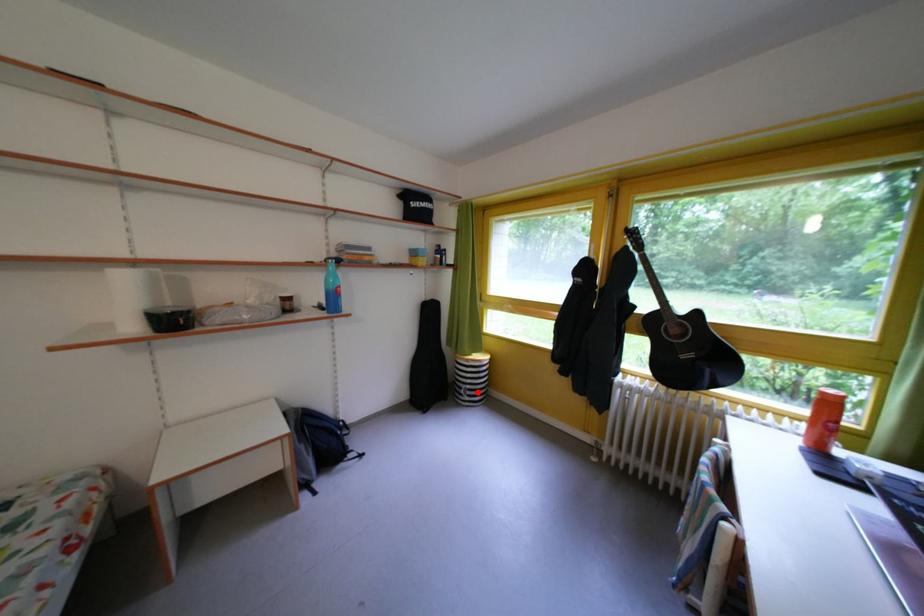
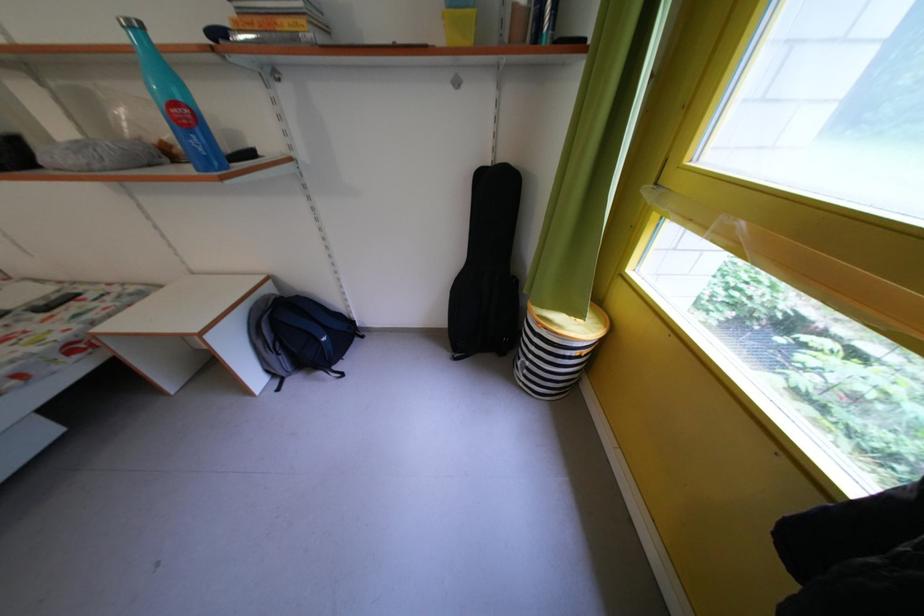
The point at the highlighted location is marked in the first image. Where is the corresponding point in the second image?

(537, 369)